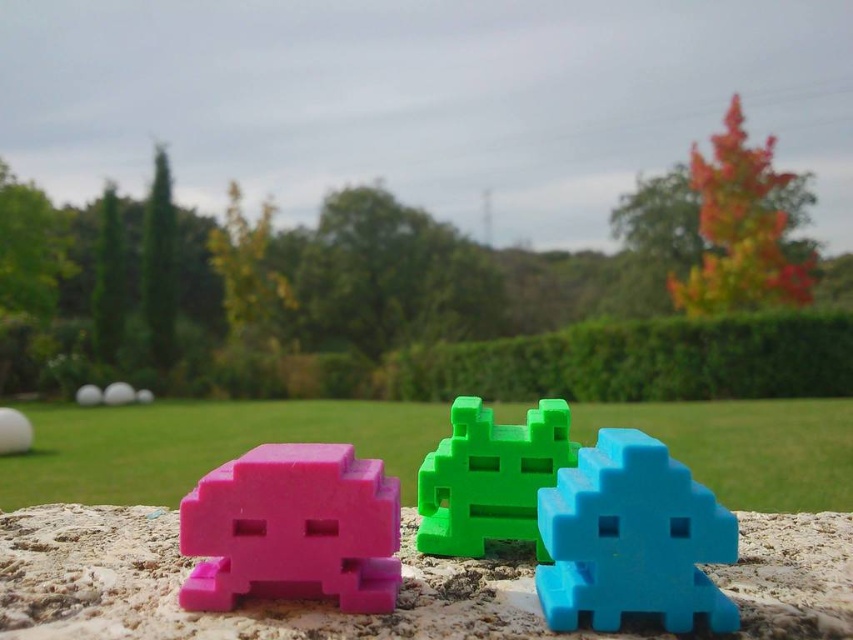
Question: Where is matte plastic toy at center located in relation to matte white sphere at center in the image?

Choices:
 (A) left
 (B) right

Answer: (B)

Question: Which object appears closest to the camera in this image?

Choices:
 (A) white matte golf ball at upper left
 (B) matte plastic toy at center
 (C) green matte toy at center

Answer: (B)

Question: Which point is farther to the camera?

Choices:
 (A) white matte golf ball at upper left
 (B) pink matte toy at center

Answer: (A)

Question: Is green matte toy at center below pink matte toy at center?

Choices:
 (A) no
 (B) yes

Answer: (A)

Question: Among these points, which one is farthest from the camera?

Choices:
 (A) (456, 442)
 (B) (93, 385)
 (C) (119, 401)
 (D) (193, 520)

Answer: (B)

Question: Can you confirm if pink matte toy at center is wider than matte white sphere at center?

Choices:
 (A) yes
 (B) no

Answer: (A)